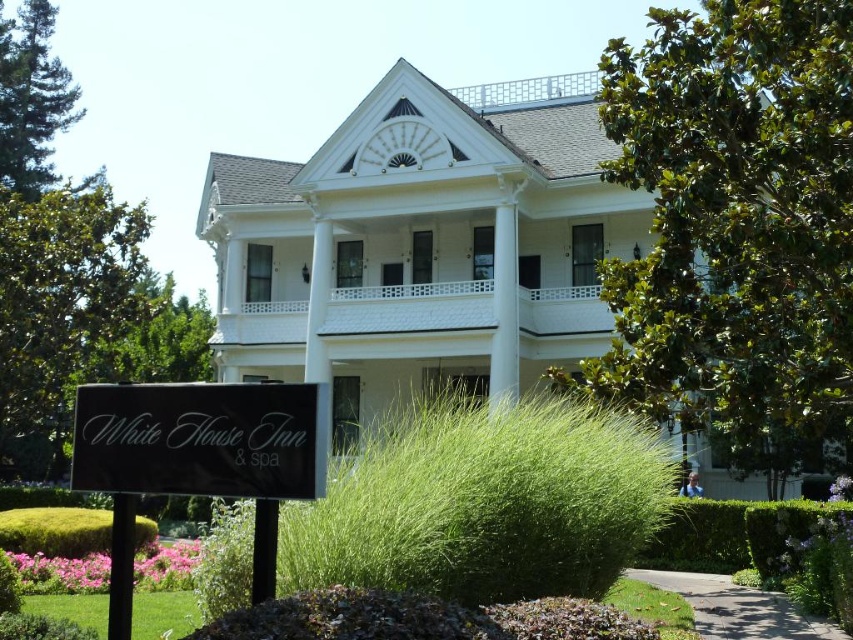
You are standing in front of the White House Inn and Spa and see the green grass at lower center and the green mossy hedge at lower left. Which of these two is positioned to the right side?

The green grass at lower center is positioned to the right of the green mossy hedge at lower left.

You are a landscape designer assessing the White House Inn property. You notice the black matte sign at lower left and the green mossy hedge at lower left. Which object is narrower in width?

The black matte sign at lower left is thinner than the green mossy hedge at lower left, so the black matte sign at lower left is narrower in width.

You are standing at the entrance of the White House Inn and Spa and want to read the black matte sign at lower left. Which direction should you face to see it clearly?

The black matte sign at lower left is located at point (201, 440), which is in the lower left area of the image. To read it clearly, you should face towards the lower left direction from the entrance.